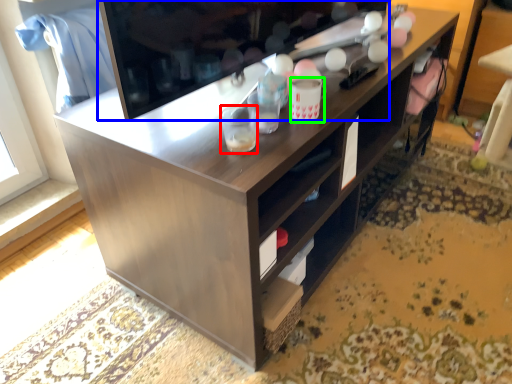
Question: Which object is the closest to the beverage (highlighted by a red box)? Choose among these: television (highlighted by a blue box) or beverage (highlighted by a green box).

Choices:
 (A) television
 (B) beverage

Answer: (B)